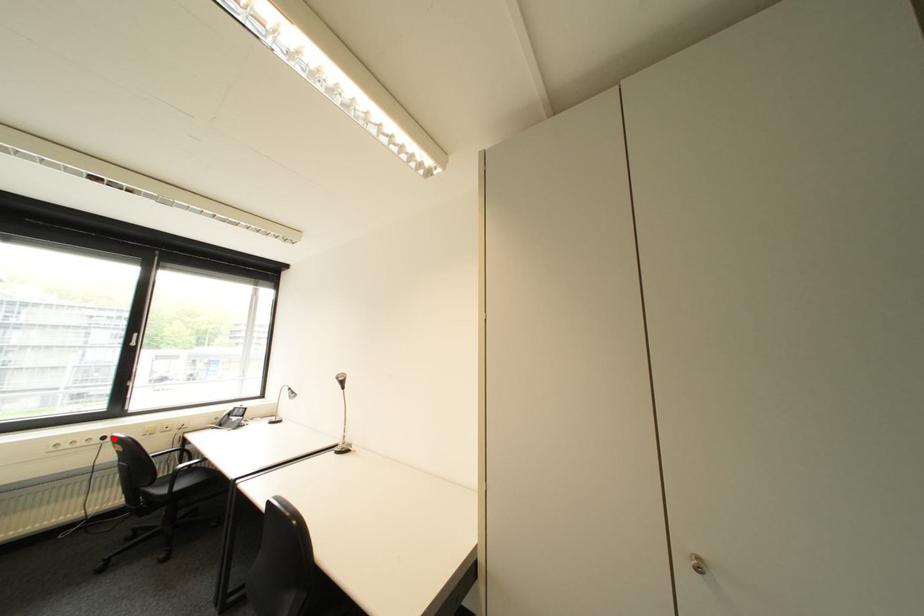
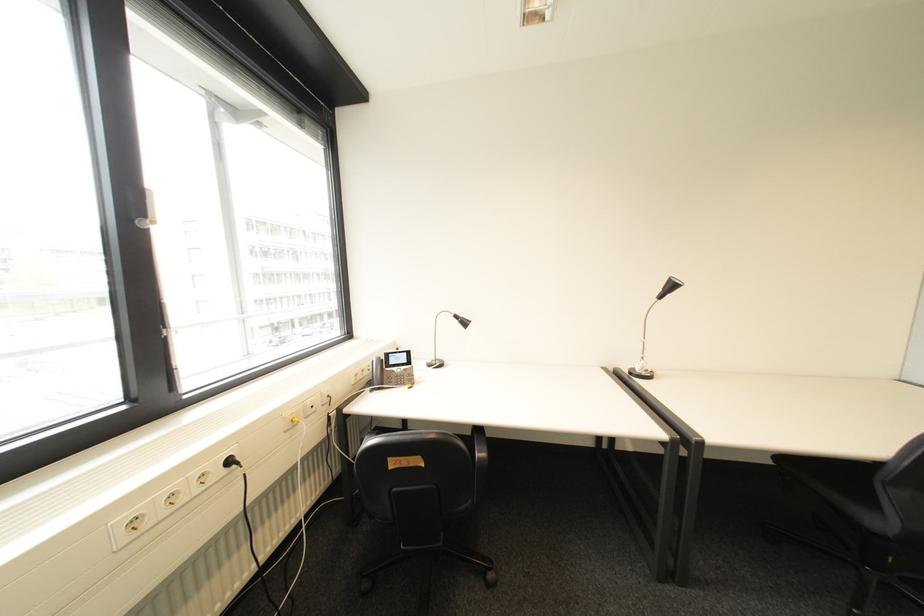
In the second image, find the point that corresponds to the highlighted location in the first image.

(239, 463)